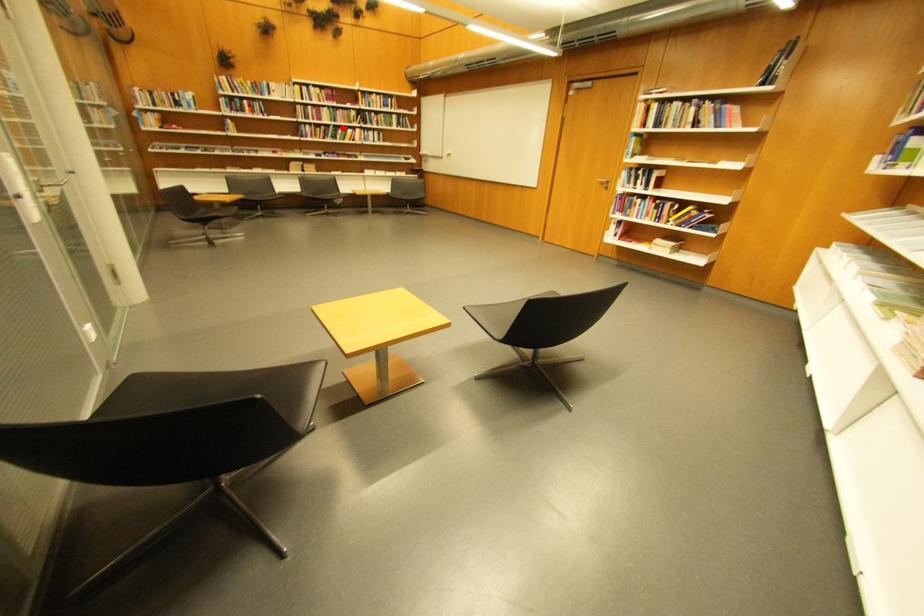
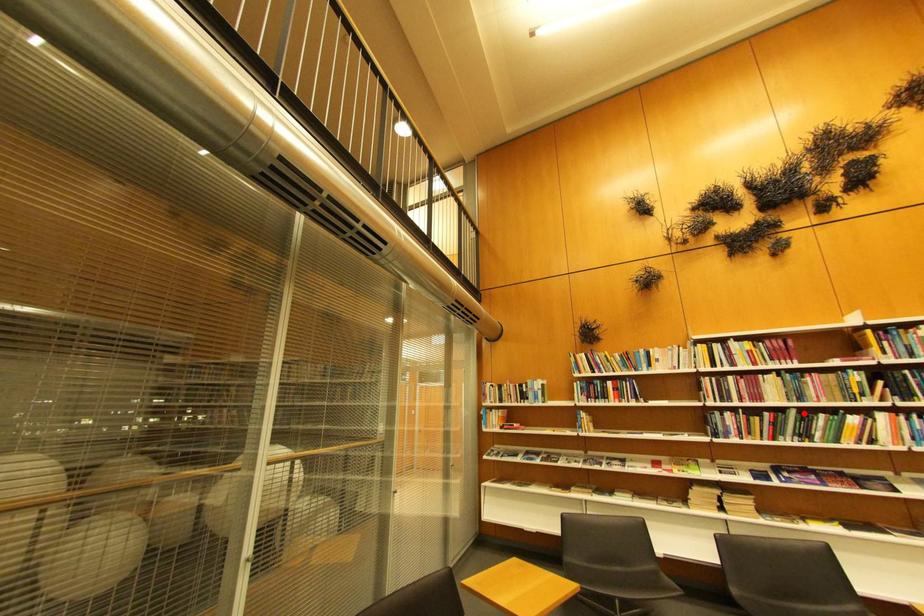
I am providing you with two images of the same scene from different viewpoints. A red point is marked on the first image and another point is marked on the second image. Does the point marked in image1 correspond to the same location as the one in image2?

Yes